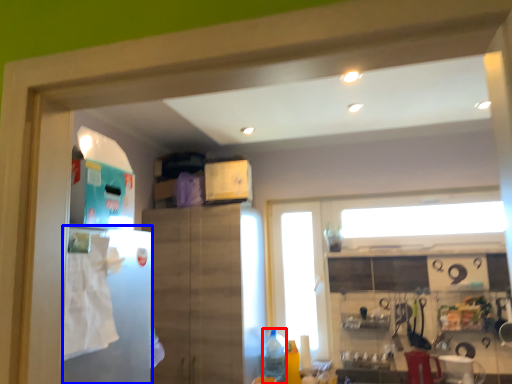
Question: Which of the following is the closest to the observer, bottle (highlighted by a red box) or fridge (highlighted by a blue box)?

Choices:
 (A) bottle
 (B) fridge

Answer: (B)